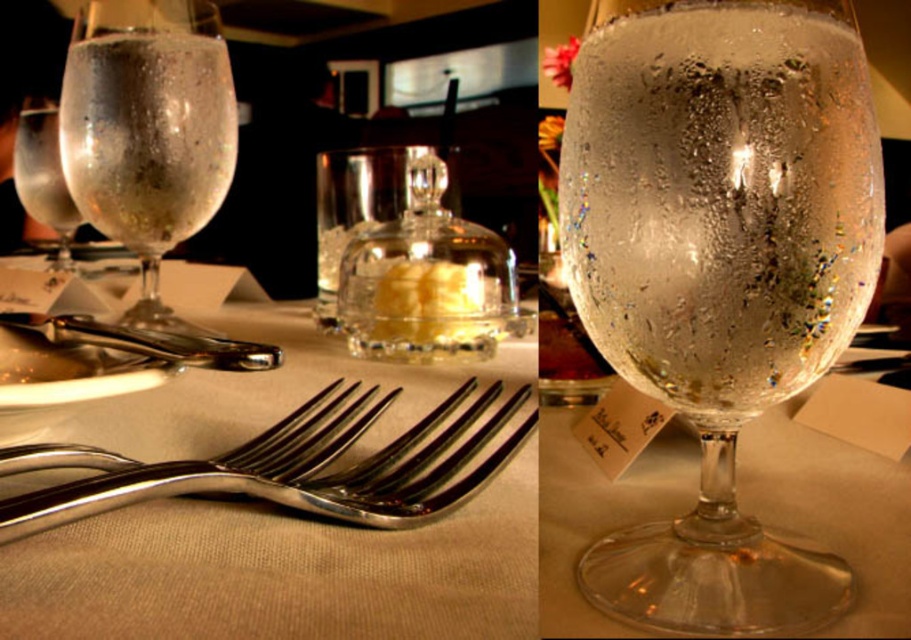
Looking at this image, you are standing at the edge of the dining table and want to place a small napkin at point (719, 269). What will the napkin be placed on?

The napkin will be placed on the translucent speckled glass at center because point (719, 269) is on the translucent speckled glass at center.

Looking at this image, you are setting up a table for a dinner party and want to place a tall centerpiece in the middle. Which glass, the translucent speckled glass at center or the clear textured glass at upper left, is more likely to tip over if the centerpiece is placed too close?

The clear textured glass at upper left is more likely to tip over because it has a smaller height compared to the translucent speckled glass at center, making it less stable.

You are a server who needs to place a menu on the table without knocking over any items. The menu is 12 inches long. Can you safely place it between the three forks and the translucent glass wine glass at center?

The distance between the three forks and the translucent glass wine glass at center is 18.68 inches. Since the menu is only 12 inches long, it can be placed safely between them without knocking anything over.